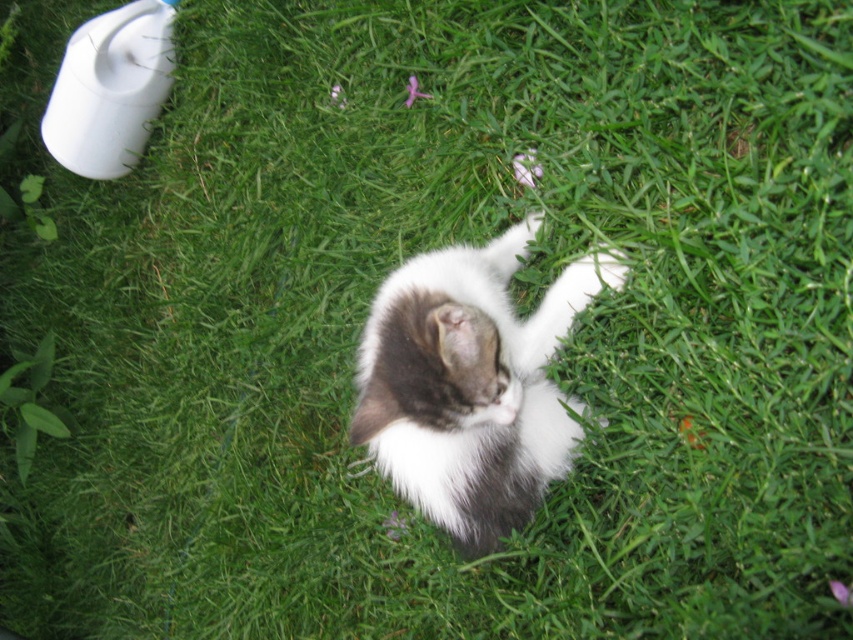
Question: Which point is farther from the camera taking this photo?

Choices:
 (A) (447, 365)
 (B) (53, 134)

Answer: (B)

Question: Is fluffy white-gray cat at center above white matte toilet at upper left?

Choices:
 (A) no
 (B) yes

Answer: (A)

Question: Among these objects, which one is farthest from the camera?

Choices:
 (A) fluffy white-gray cat at center
 (B) white matte toilet at upper left

Answer: (B)

Question: Is fluffy white-gray cat at center behind white matte toilet at upper left?

Choices:
 (A) no
 (B) yes

Answer: (A)

Question: Is the position of fluffy white-gray cat at center more distant than that of white matte toilet at upper left?

Choices:
 (A) no
 (B) yes

Answer: (A)

Question: Which point is closer to the camera taking this photo?

Choices:
 (A) (409, 332)
 (B) (173, 13)

Answer: (A)